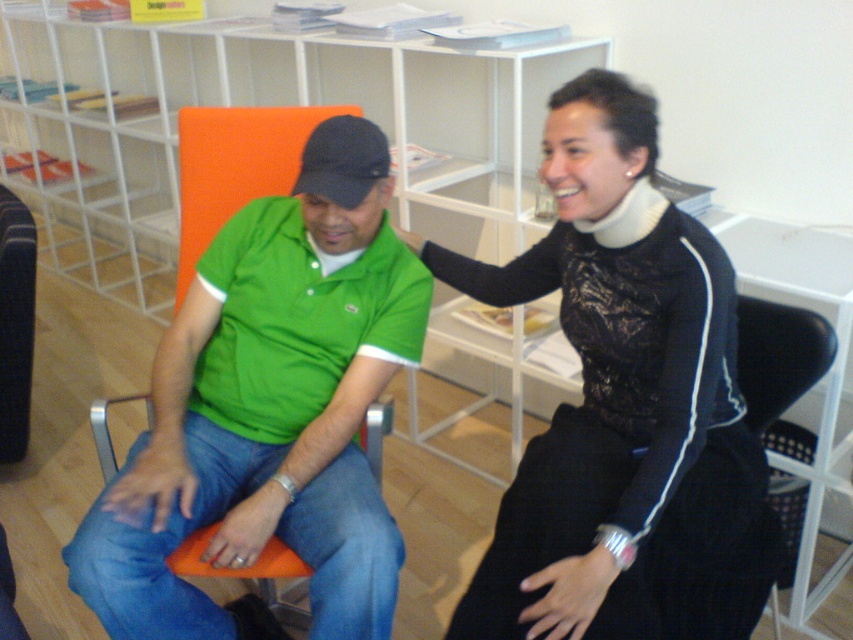
What is the object located at the coordinates point (624, 412)?

The object located at point (624, 412) is the black lace top at center.

You are trying to decide which clothing item to choose for an event. You see the black lace top at center and the green polo shirt at center in the image. Based on their widths, which one do you think would be more suitable if you want something wider?

The black lace top at center might be wider than green polo shirt at center, so it would be more suitable if you want something wider.

You are a photographer trying to capture a closeup of the green polo shirt at center and the white foam neckband at upper center. Which object should you focus on first to ensure it appears sharp in the photo?

The green polo shirt at center is closer to the viewer than the white foam neckband at upper center, so you should focus on the green polo shirt at center first to ensure it appears sharp.